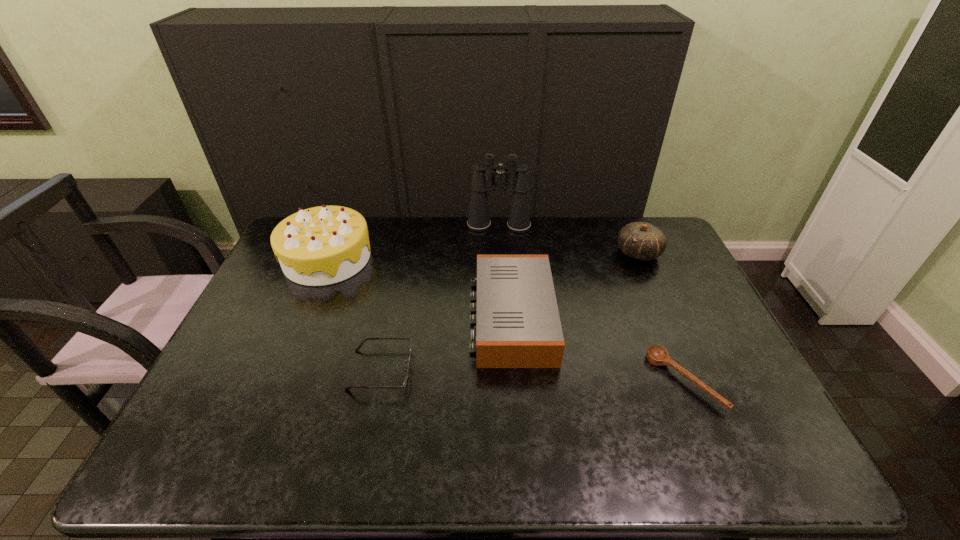
Find the location of `free space between the fourth tallest object and the wooden spoon`. free space between the fourth tallest object and the wooden spoon is located at coordinates [598, 349].

Find the location of a particular element. This screenshot has width=960, height=540. empty space between the wooden spoon and the gourd is located at coordinates (661, 317).

You are a GUI agent. You are given a task and a screenshot of the screen. Output one action in this format:
    pyautogui.click(x=<x>, y=<y>)
    Task: Click on the vacant region between the gourd and the third shortest object
    
    Given the screenshot: What is the action you would take?
    coord(575,285)

At what (x,y) coordinates should I click in order to perform the action: click on free space between the radio receiver and the birthday cake. Please return your answer as a coordinate pair (x, y). Looking at the image, I should click on (420, 288).

This screenshot has height=540, width=960. Identify the location of vacant area that lies between the shortest object and the tallest object. (591, 303).

Locate an element on the screen. Image resolution: width=960 pixels, height=540 pixels. vacant space in between the second shortest object and the tallest object is located at coordinates (440, 298).

Locate an element on the screen. vacant point located between the binoculars and the second object from left to right is located at coordinates (440, 298).

Locate an element on the screen. The width and height of the screenshot is (960, 540). vacant area that lies between the second tallest object and the second object from left to right is located at coordinates (354, 314).

The width and height of the screenshot is (960, 540). Identify the location of unoccupied area between the wooden spoon and the radio receiver. (598, 349).

Where is `vacant region between the tallest object and the shortest object`? vacant region between the tallest object and the shortest object is located at coordinates (591, 303).